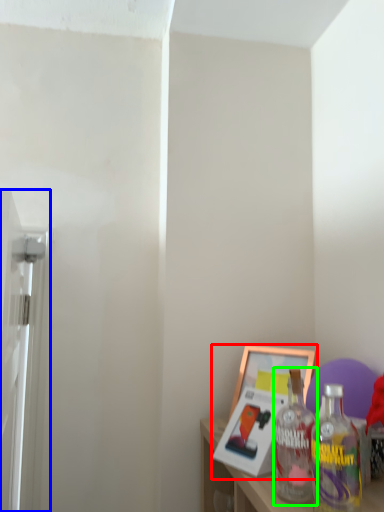
Question: Which is farther away from picture frame (highlighted by a red box)? screen door (highlighted by a blue box) or bottle (highlighted by a green box)?

Choices:
 (A) screen door
 (B) bottle

Answer: (A)